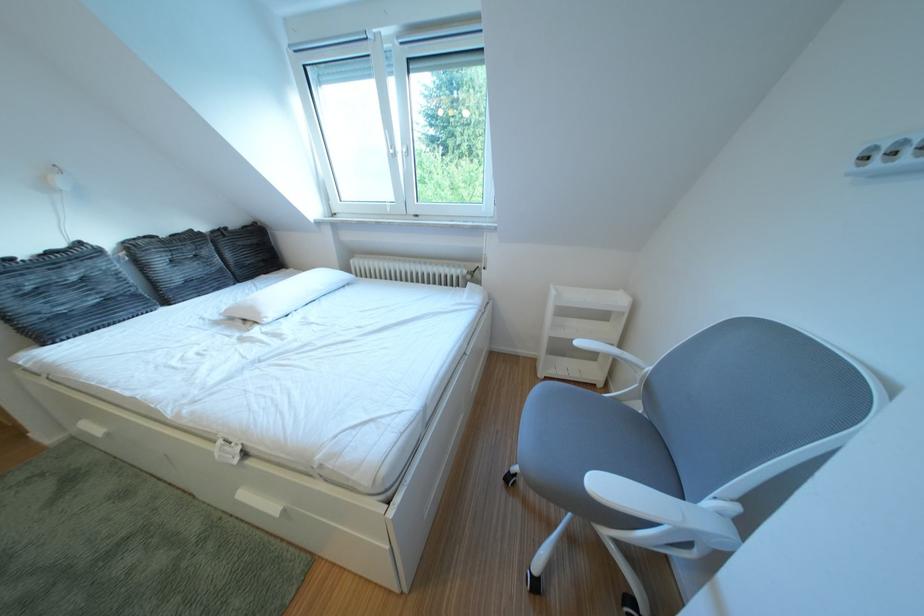
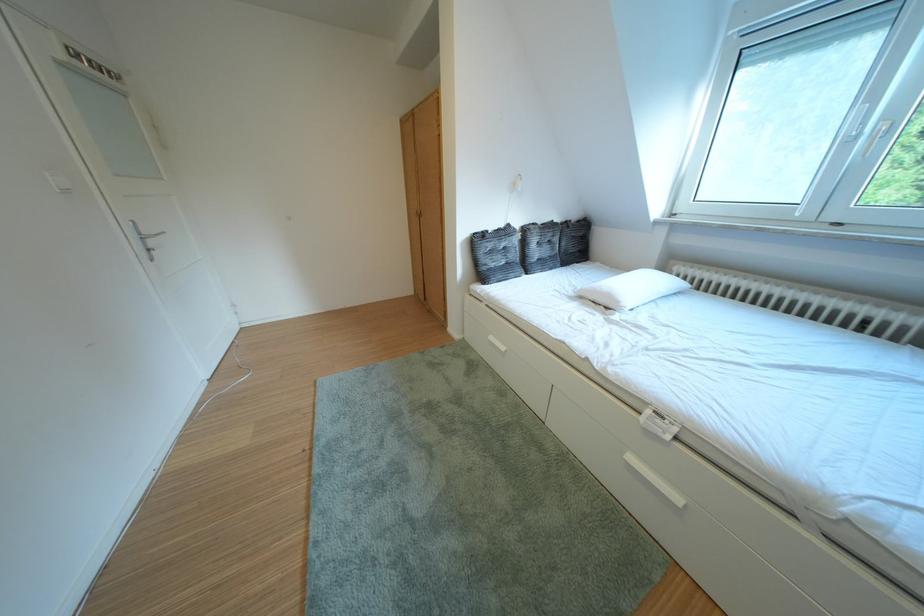
In the second image, find the point that corresponds to point (247, 228) in the first image.

(588, 222)